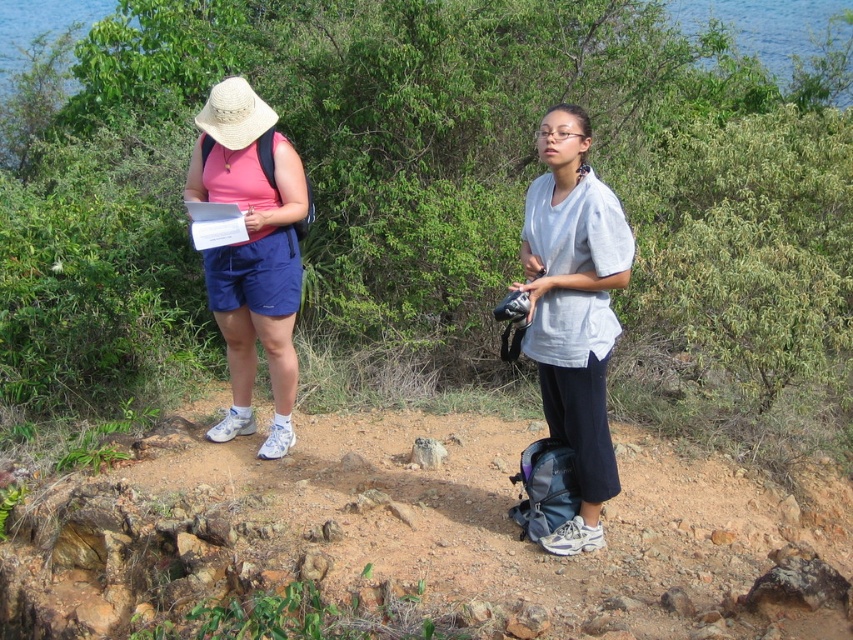
You are planning to take a photo of both the light gray cotton shirt at center and the matte pink shirt at left. Which shirt should you focus on first if you want to capture both in the frame without moving the camera?

The light gray cotton shirt at center is smaller than the matte pink shirt at left, so you should focus on the matte pink shirt at left first to ensure it fits within the frame, then adjust slightly to include the smaller light gray cotton shirt at center.

Based on the photo, based on the coordinates provided, where is the light gray cotton shirt at center located in the image?

The light gray cotton shirt at center is located at the 2D coordinates point (573, 308).